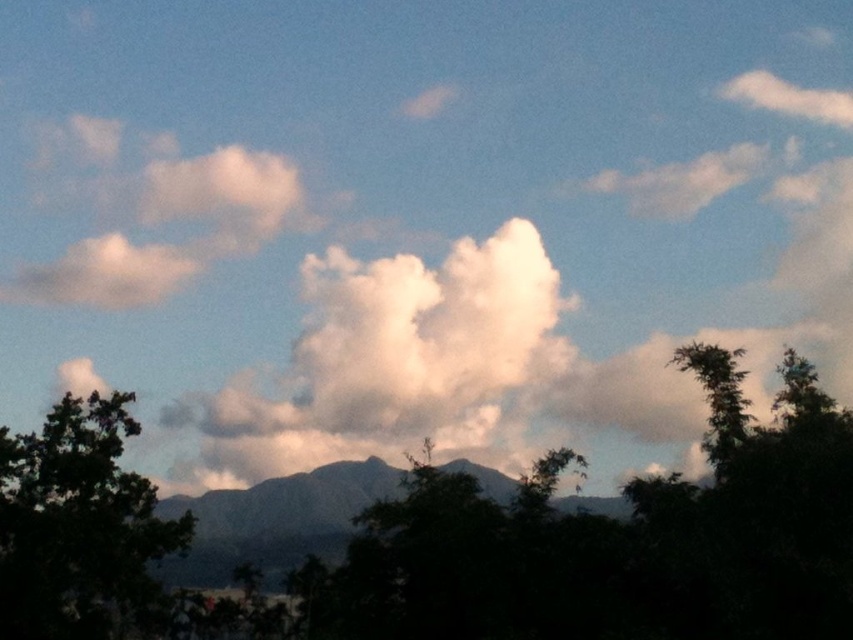
You are an observer looking at the landscape. Which tree, the dark green leafy tree at lower left or the green leafy tree at right, is positioned lower in the image?

The dark green leafy tree at lower left is positioned lower in the image than the green leafy tree at right.

You are an artist trying to paint this landscape. You notice a point marked at coordinates (80, 529). What object is located at that point?

The point at coordinates (80, 529) indicates a dark green leafy tree at lower left.